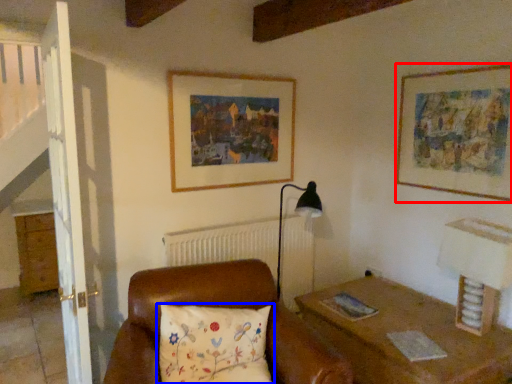
Question: Which object appears farthest to the camera in this image, picture frame (highlighted by a red box) or pillow (highlighted by a blue box)?

Choices:
 (A) picture frame
 (B) pillow

Answer: (A)